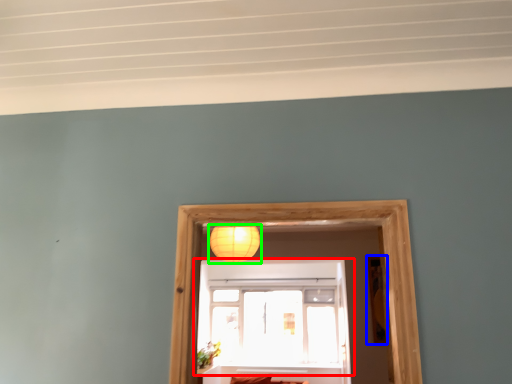
Question: Considering the real-world distances, which object is closest to window (highlighted by a red box)? picture frame (highlighted by a blue box) or lamp (highlighted by a green box).

Choices:
 (A) picture frame
 (B) lamp

Answer: (B)